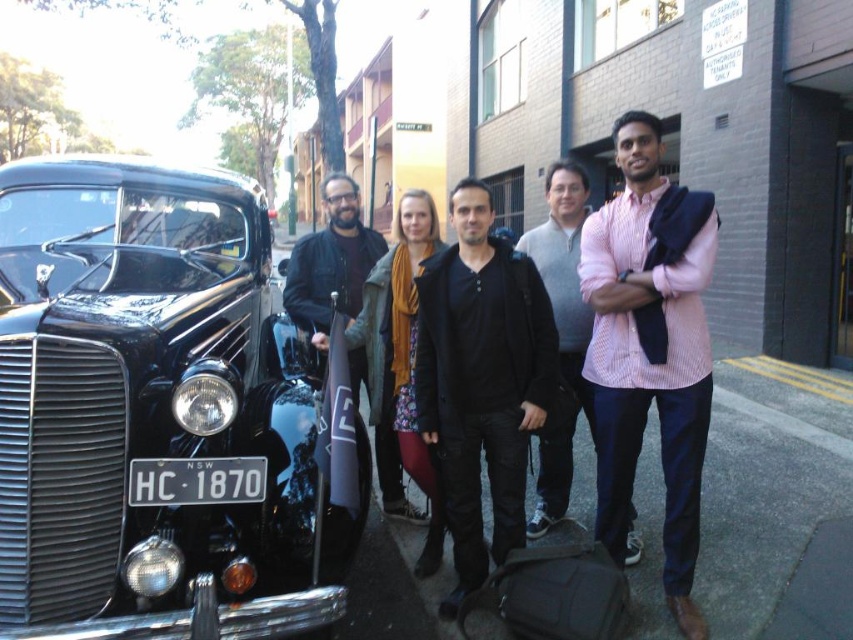
You are a photographer who wants to take a photo of the shiny black car at left and the black metal license plate at lower left. However, the license plate is currently blocked by part of the car. Can you move the camera to the right to capture both objects in the frame without obstruction?

The shiny black car at left is positioned over the black metal license plate at lower left, so moving the camera to the right might allow you to capture both objects without the car blocking the license plate.

You are a photographer standing at the camera position. You want to take a photo of the shiny black car at left. Considering the distance between you and the car, can you comfortably step forward to get closer without moving the car itself?

The distance between the shiny black car at left and the camera is 2.17 meters, so yes, you can comfortably step forward to get closer as the distance allows enough space to move closer without needing to move the car itself.